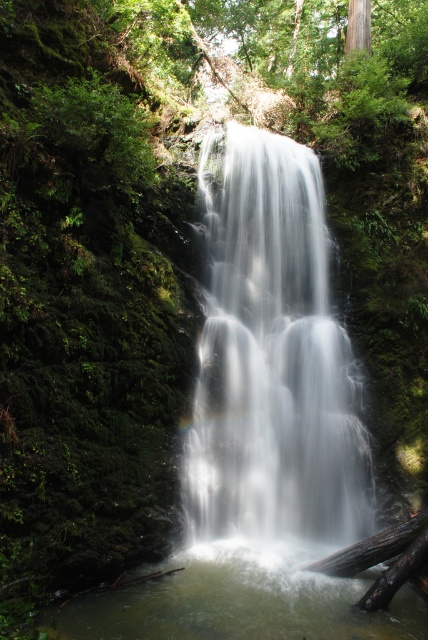
How much distance is there between white silky waterfall at center and clear water at center?

white silky waterfall at center is 6.21 feet from clear water at center.

Which is above, white silky waterfall at center or clear water at center?

white silky waterfall at center is above.

Is point (208, 381) farther from viewer compared to point (204, 556)?

Yes.

Identify the location of white silky waterfall at center. (273, 360).